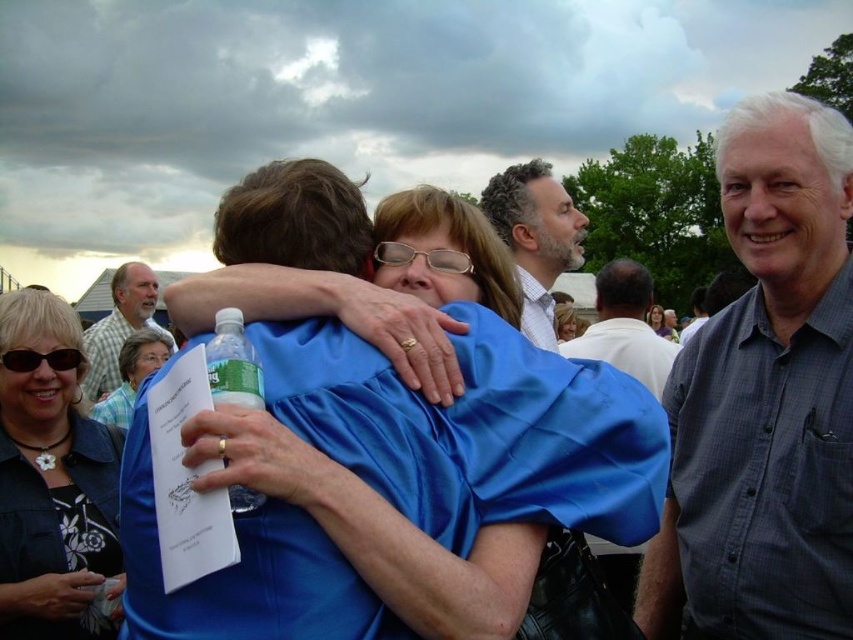
You are a photographer at this event and need to decide where to place a new banner. The banner is 1 meter wide. There are two shirts visible in the image, the white shirt at upper center and the blue fabric shirt at center. Which shirt can the banner fit next to without overlapping, considering their widths?

The white shirt at upper center is thinner than the blue fabric shirt at center. Since the banner is 1 meter wide, it can fit next to the white shirt at upper center as it has a smaller width, allowing enough space. The blue fabric shirt at center is wider and may not leave sufficient space for the banner.